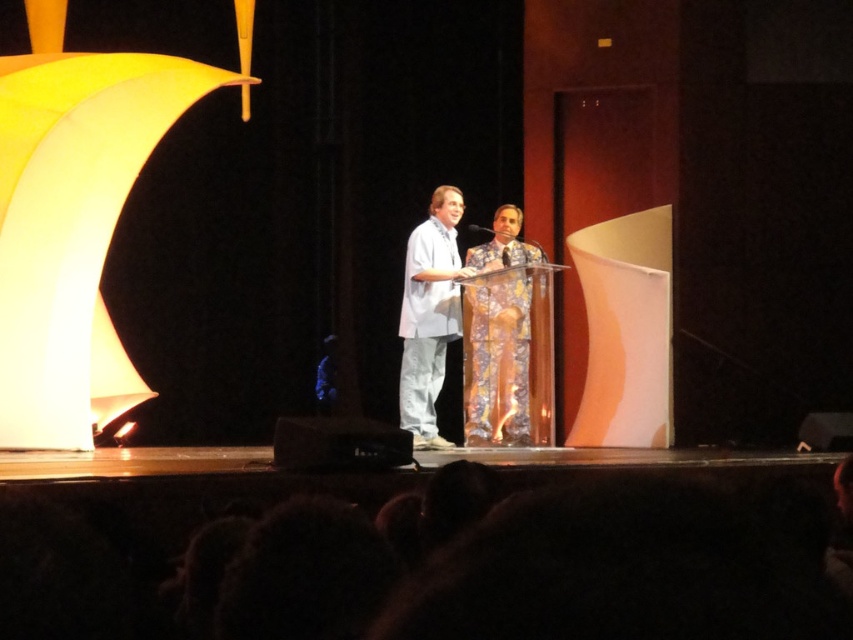
Is floral-patterned suit at center thinner than white cotton shirt at center?

In fact, floral-patterned suit at center might be wider than white cotton shirt at center.

Consider the image. Does floral-patterned suit at center have a lesser height compared to white cotton shirt at center?

Correct, floral-patterned suit at center is not as tall as white cotton shirt at center.

Which is behind, point (489, 364) or point (440, 307)?

The point (440, 307) is behind.

What are the coordinates of `floral-patterned suit at center` in the screenshot? It's located at (498, 336).